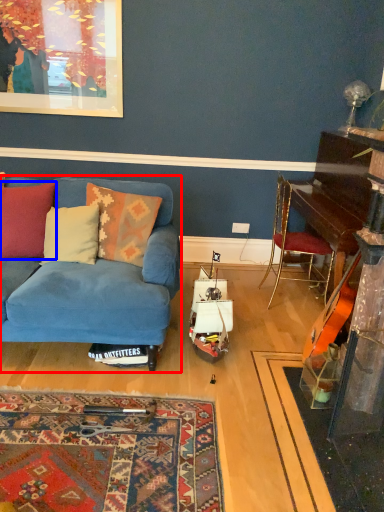
Question: Which object appears closest to the camera in this image, studio couch (highlighted by a red box) or pillow (highlighted by a blue box)?

Choices:
 (A) studio couch
 (B) pillow

Answer: (A)